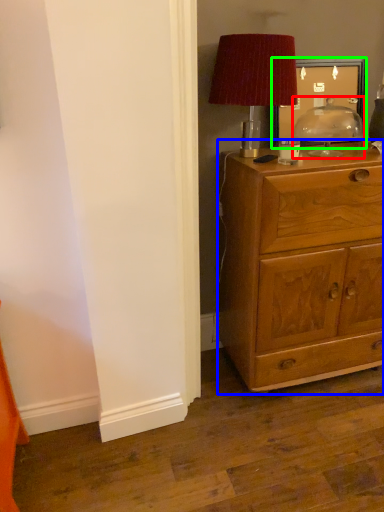
Question: Which is farther away from table lamp (highlighted by a red box)? chest of drawers (highlighted by a blue box) or picture frame (highlighted by a green box)?

Choices:
 (A) chest of drawers
 (B) picture frame

Answer: (A)